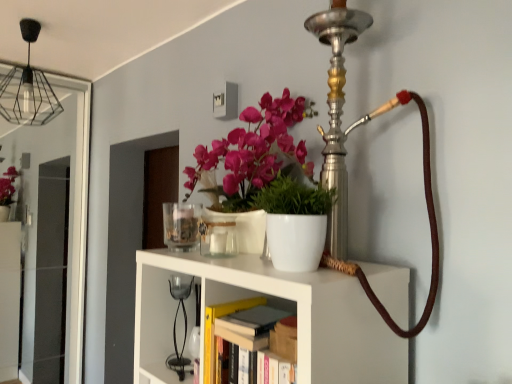
Question: Is white matte shelf at center at the right side of matte black light bulb at upper left?

Choices:
 (A) yes
 (B) no

Answer: (A)

Question: Are white matte shelf at center and matte black light bulb at upper left beside each other?

Choices:
 (A) no
 (B) yes

Answer: (A)

Question: Is white matte shelf at center outside matte black light bulb at upper left?

Choices:
 (A) no
 (B) yes

Answer: (B)

Question: Does white matte shelf at center have a greater width compared to matte black light bulb at upper left?

Choices:
 (A) yes
 (B) no

Answer: (A)

Question: Can you confirm if white matte shelf at center is taller than matte black light bulb at upper left?

Choices:
 (A) yes
 (B) no

Answer: (A)

Question: Considering the relative sizes of white matte shelf at center and matte black light bulb at upper left in the image provided, is white matte shelf at center bigger than matte black light bulb at upper left?

Choices:
 (A) yes
 (B) no

Answer: (A)

Question: Can you confirm if transparent glass door at left is taller than white matte shelf at center?

Choices:
 (A) no
 (B) yes

Answer: (B)

Question: Does transparent glass door at left have a larger size compared to white matte shelf at center?

Choices:
 (A) yes
 (B) no

Answer: (B)

Question: From the image's perspective, is transparent glass door at left located beneath white matte shelf at center?

Choices:
 (A) no
 (B) yes

Answer: (A)

Question: Is transparent glass door at left positioned behind white matte shelf at center?

Choices:
 (A) no
 (B) yes

Answer: (B)

Question: Is transparent glass door at left positioned far away from white matte shelf at center?

Choices:
 (A) no
 (B) yes

Answer: (B)

Question: Can you confirm if transparent glass door at left is positioned to the right of white matte shelf at center?

Choices:
 (A) no
 (B) yes

Answer: (A)

Question: Is black glass table lamp at center at the back of white matte shelf at center?

Choices:
 (A) no
 (B) yes

Answer: (A)